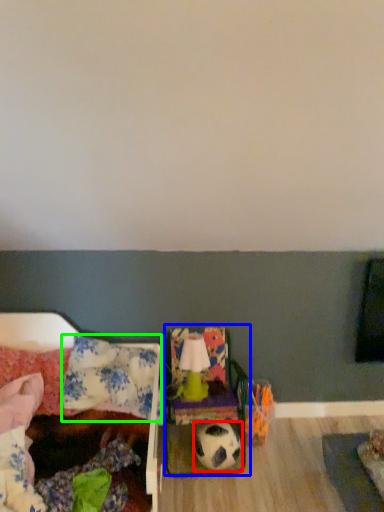
Question: Which object is the farthest from football (highlighted by a red box)? Choose among these: armchair (highlighted by a blue box) or pillow (highlighted by a green box).

Choices:
 (A) armchair
 (B) pillow

Answer: (B)